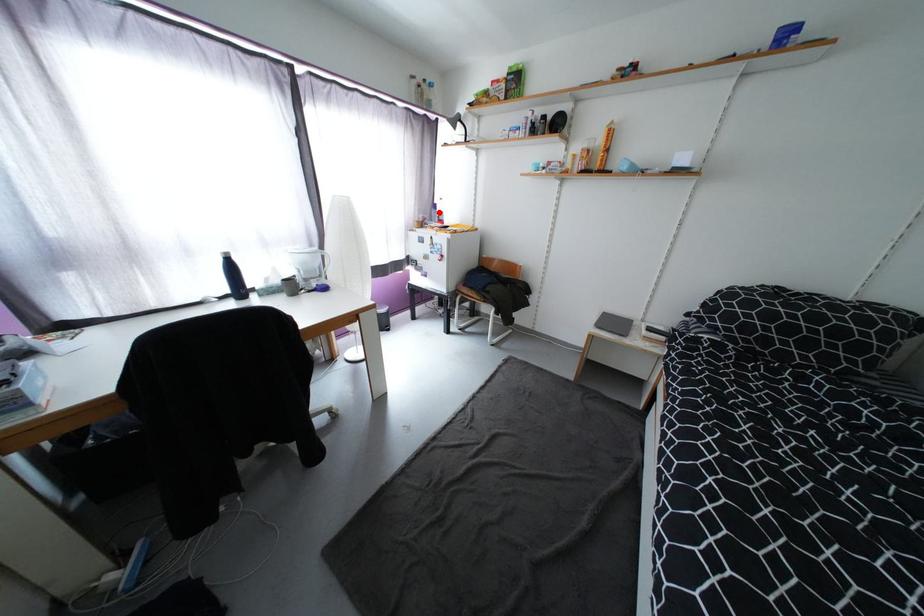
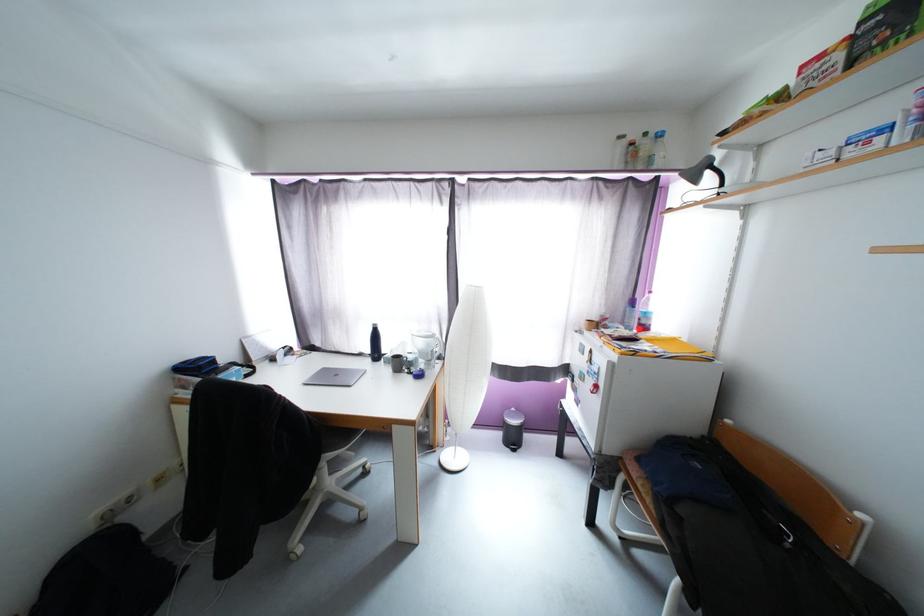
Locate, in the second image, the point that corresponds to the highlighted location in the first image.

(634, 310)